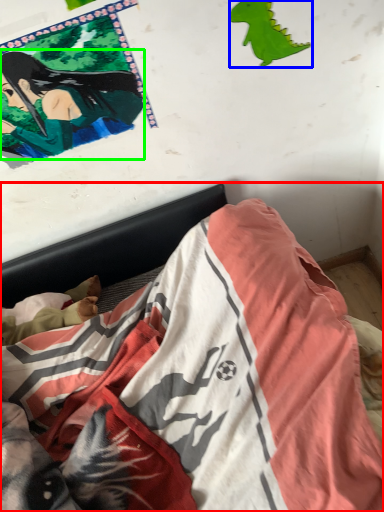
Question: Which is farther away from bed (highlighted by a red box)? print (highlighted by a blue box) or person (highlighted by a green box)?

Choices:
 (A) print
 (B) person

Answer: (A)